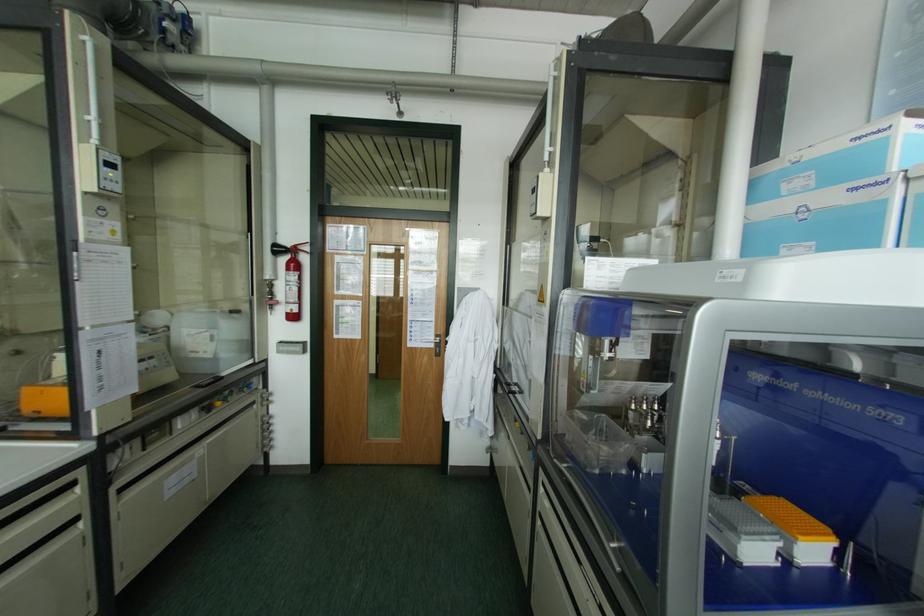
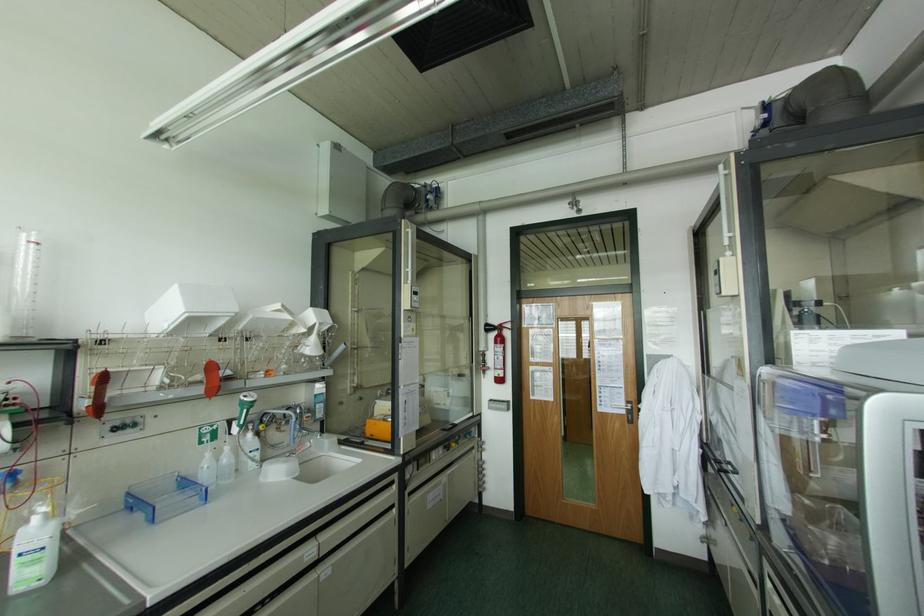
Locate, in the second image, the point that corresponds to (252,402) in the first image.

(472, 448)